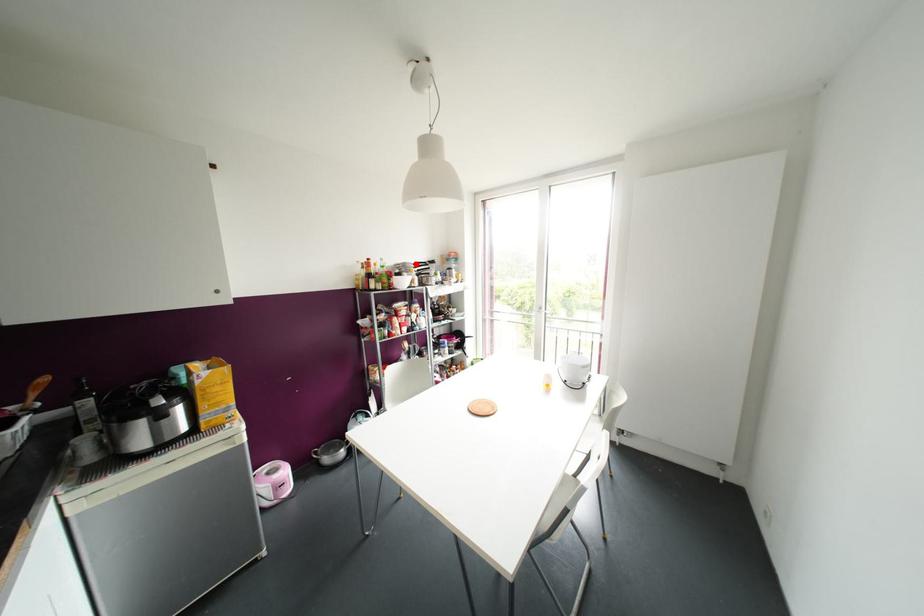
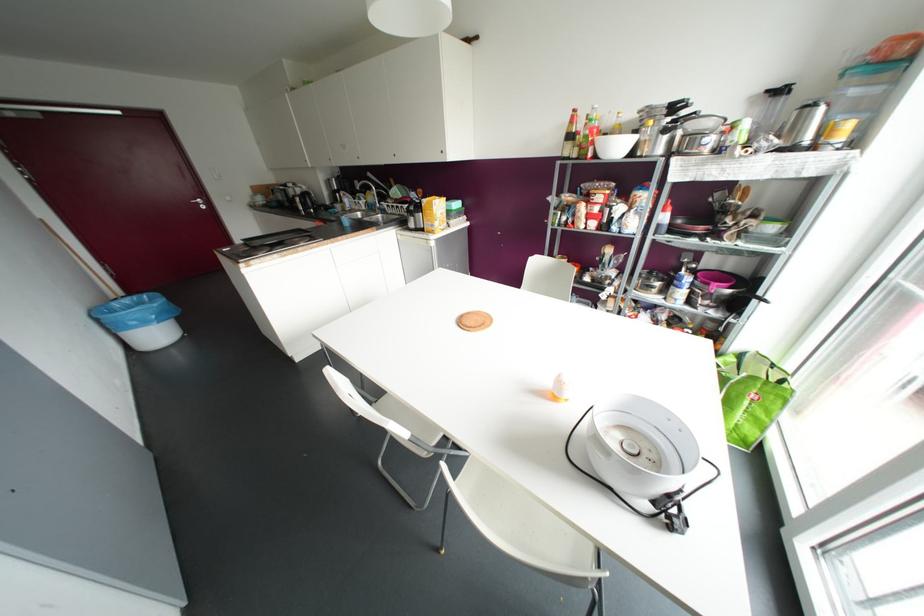
Where in the second image is the point corresponding to the highlighted location from the first image?

(673, 107)